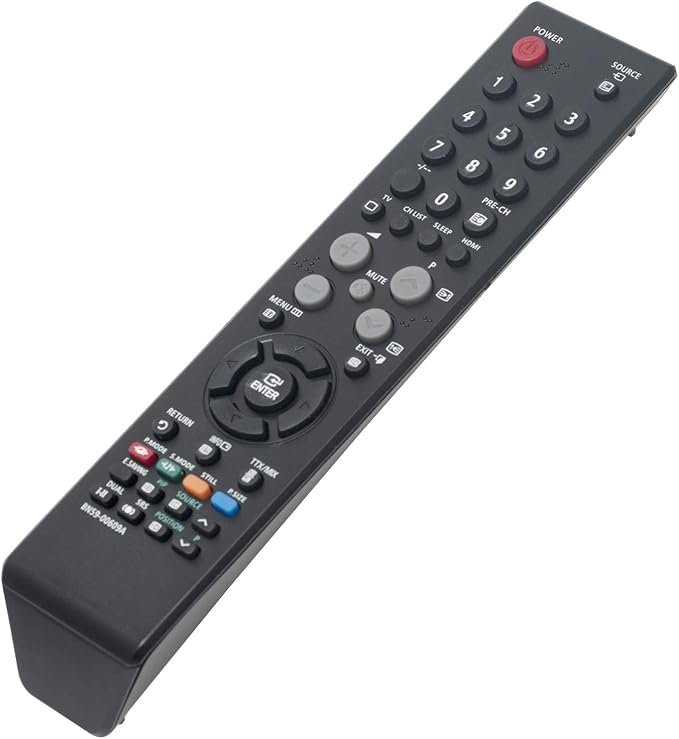
Find the location of a particular element. tv remote colored buttons is located at coordinates (143, 452), (172, 466), (196, 482), (225, 500).